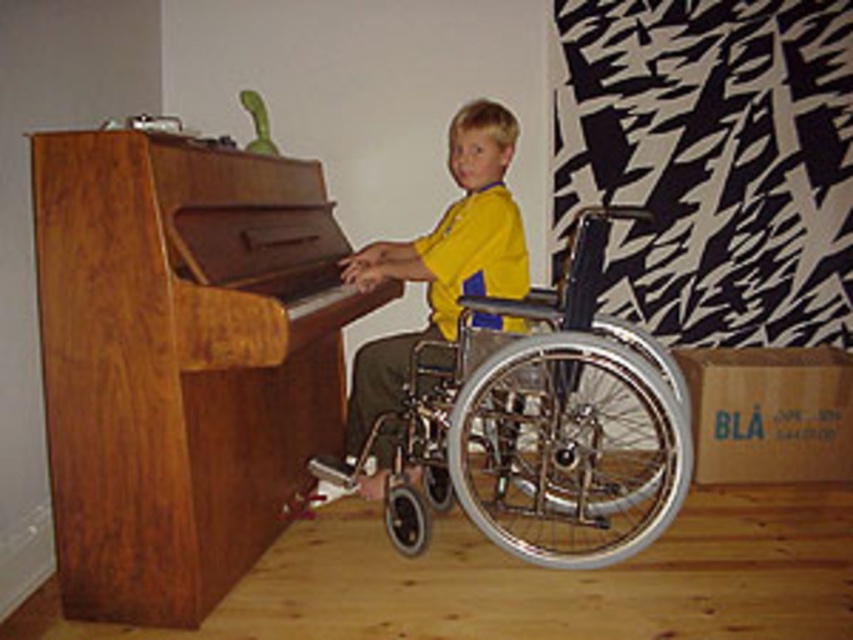
Is point (315, 168) closer to viewer compared to point (523, 310)?

No, it is not.

Where is `wooden piano at left`? wooden piano at left is located at coordinates (181, 360).

Is wooden piano at left taller than metallic silver wheelchair at center?

Indeed, wooden piano at left has a greater height compared to metallic silver wheelchair at center.

Is wooden piano at left thinner than metallic silver wheelchair at center?

No, wooden piano at left is not thinner than metallic silver wheelchair at center.

Find the location of `wooden piano at left`. wooden piano at left is located at coordinates (181, 360).

Who is positioned more to the left, silver metallic wheelchair at center or metallic silver wheelchair at center?

metallic silver wheelchair at center is more to the left.

Can you confirm if silver metallic wheelchair at center is positioned below metallic silver wheelchair at center?

Yes, silver metallic wheelchair at center is below metallic silver wheelchair at center.

Which is behind, point (666, 451) or point (379, 403)?

Positioned behind is point (379, 403).

Where is `silver metallic wheelchair at center`? This screenshot has height=640, width=853. silver metallic wheelchair at center is located at coordinates (534, 419).